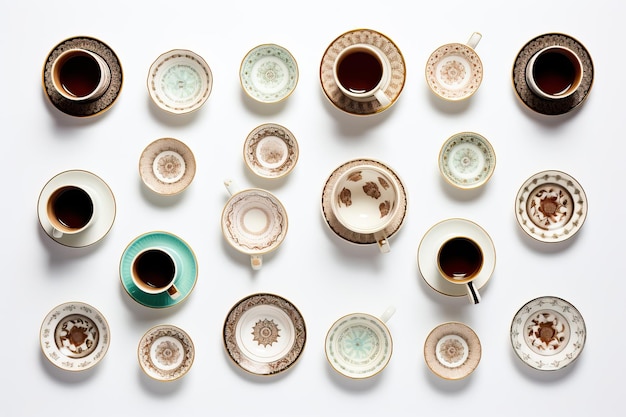
What are the coordinates of `saucers` in the screenshot? It's located at (101, 98), (105, 190), (185, 251), (345, 234), (332, 96), (526, 96), (489, 246).